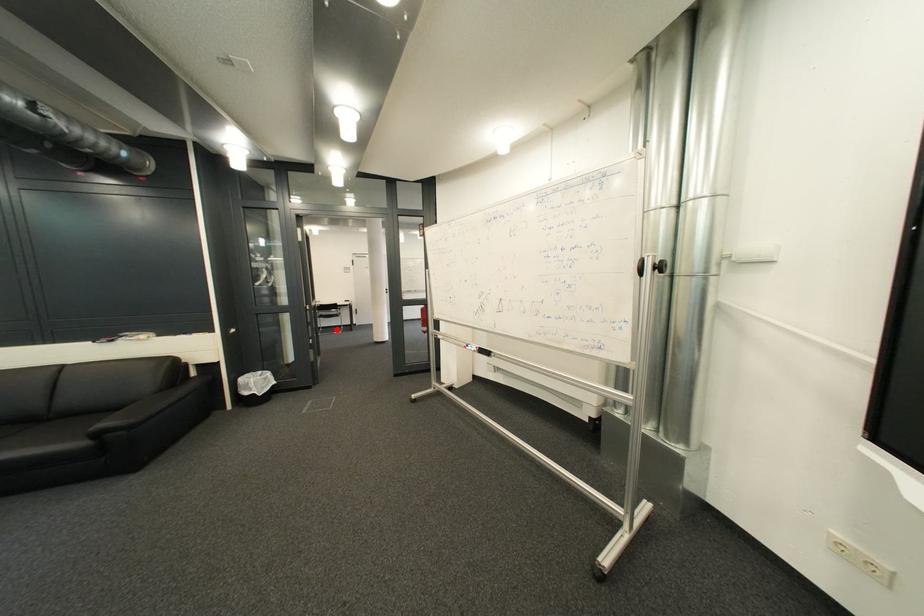
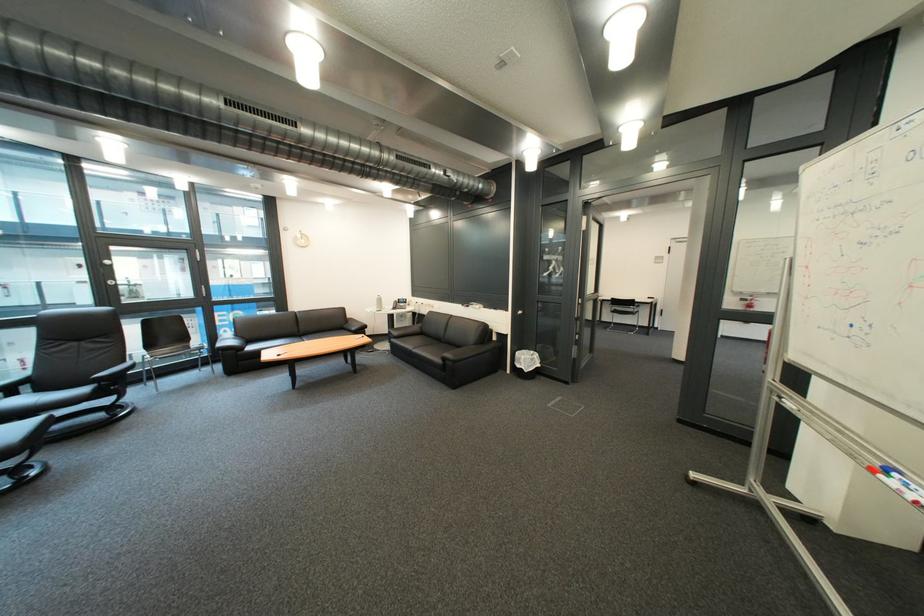
Locate, in the second image, the point that corresponds to the highlighted location in the first image.

(628, 325)